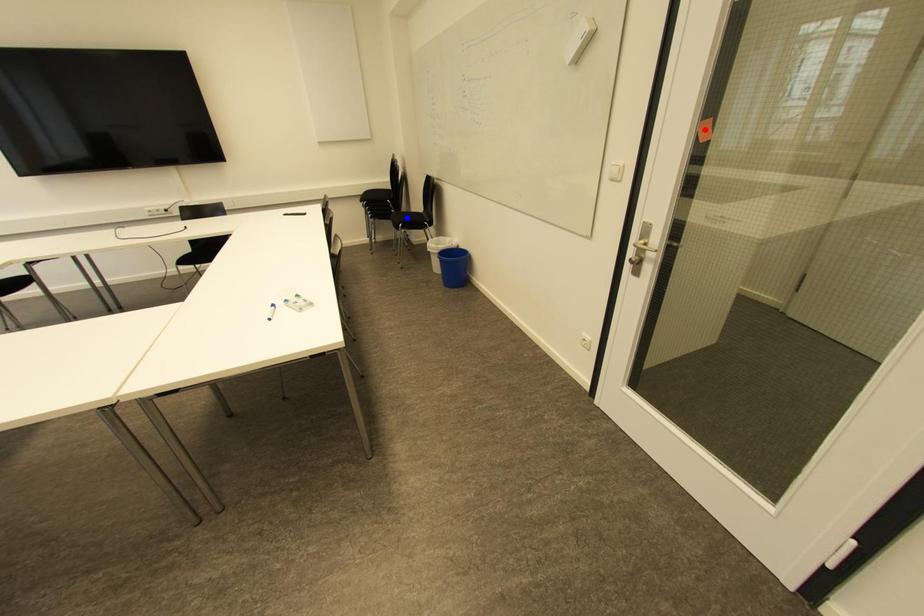
Question: In the image, two points are highlighted. Which point is nearer to the camera? Reply with the corresponding letter.

Choices:
 (A) blue point
 (B) red point

Answer: (B)